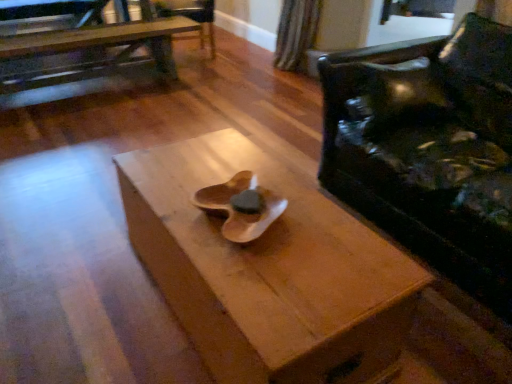
Question: From the image's perspective, does wooden table at upper left, arranged as the 1th table when viewed from the back, appear lower than wooden armchair at upper center?

Choices:
 (A) yes
 (B) no

Answer: (A)

Question: Is wooden table at upper left, the second table ordered from the bottom, outside of wooden armchair at upper center?

Choices:
 (A) yes
 (B) no

Answer: (A)

Question: Is wooden table at upper left, the 2th table viewed from the right, positioned far away from wooden armchair at upper center?

Choices:
 (A) no
 (B) yes

Answer: (A)

Question: Considering the relative sizes of wooden table at upper left, arranged as the 1th table when viewed from the back, and wooden armchair at upper center in the image provided, is wooden table at upper left, arranged as the 1th table when viewed from the back, wider than wooden armchair at upper center?

Choices:
 (A) no
 (B) yes

Answer: (A)

Question: Is wooden table at upper left, placed as the second table when sorted from front to back, closer to camera compared to wooden armchair at upper center?

Choices:
 (A) yes
 (B) no

Answer: (A)

Question: Relative to black leather couch at right, is wooden table at center, which is counted as the 2th table, starting from the top, in front or behind?

Choices:
 (A) front
 (B) behind

Answer: (A)

Question: In terms of size, does wooden table at center, the 2th table in the back-to-front sequence, appear bigger or smaller than black leather couch at right?

Choices:
 (A) small
 (B) big

Answer: (A)

Question: From a real-world perspective, is wooden table at center, which is counted as the 2th table, starting from the top, above or below black leather couch at right?

Choices:
 (A) above
 (B) below

Answer: (B)

Question: Looking at their shapes, would you say wooden table at center, the 2th table in the back-to-front sequence, is wider or thinner than black leather couch at right?

Choices:
 (A) thin
 (B) wide

Answer: (A)

Question: From a real-world perspective, relative to wooden armchair at upper center, is wooden table at upper left, placed as the second table when sorted from front to back, vertically above or below?

Choices:
 (A) above
 (B) below

Answer: (B)

Question: In the image, is wooden table at upper left, the 2th table viewed from the right, positioned in front of or behind wooden armchair at upper center?

Choices:
 (A) behind
 (B) front

Answer: (B)

Question: Considering the positions of wooden table at upper left, placed as the first table when sorted from left to right, and wooden armchair at upper center in the image, is wooden table at upper left, placed as the first table when sorted from left to right, taller or shorter than wooden armchair at upper center?

Choices:
 (A) short
 (B) tall

Answer: (A)

Question: Is wooden table at upper left, arranged as the 1th table when viewed from the back, situated inside wooden armchair at upper center or outside?

Choices:
 (A) outside
 (B) inside

Answer: (A)

Question: Considering the positions of point (395, 269) and point (157, 54), is point (395, 269) closer or farther from the camera than point (157, 54)?

Choices:
 (A) closer
 (B) farther

Answer: (A)

Question: From the image's perspective, relative to wooden table at upper left, the 2th table viewed from the right, is wooden table at center, which ranks as the first table in front-to-back order, above or below?

Choices:
 (A) below
 (B) above

Answer: (A)